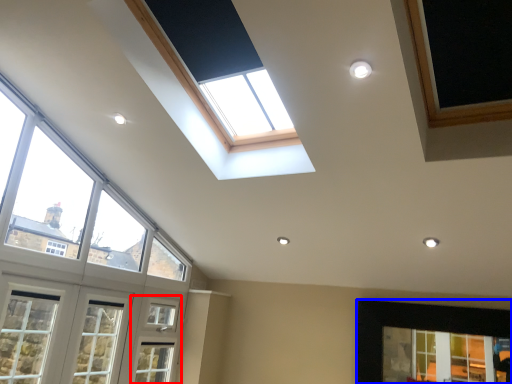
Question: Which point is closer to the camera, screen door (highlighted by a red box) or window (highlighted by a blue box)?

Choices:
 (A) screen door
 (B) window

Answer: (B)